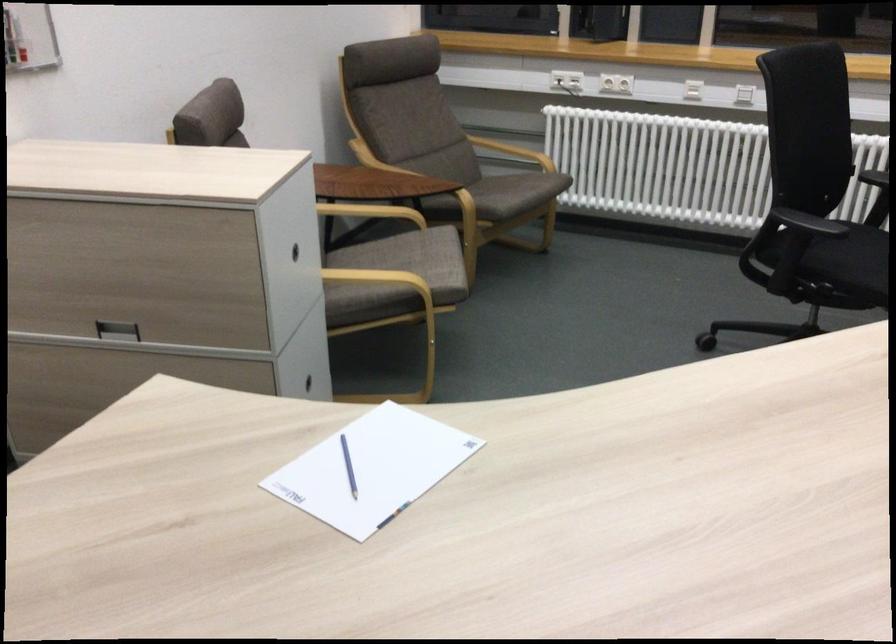
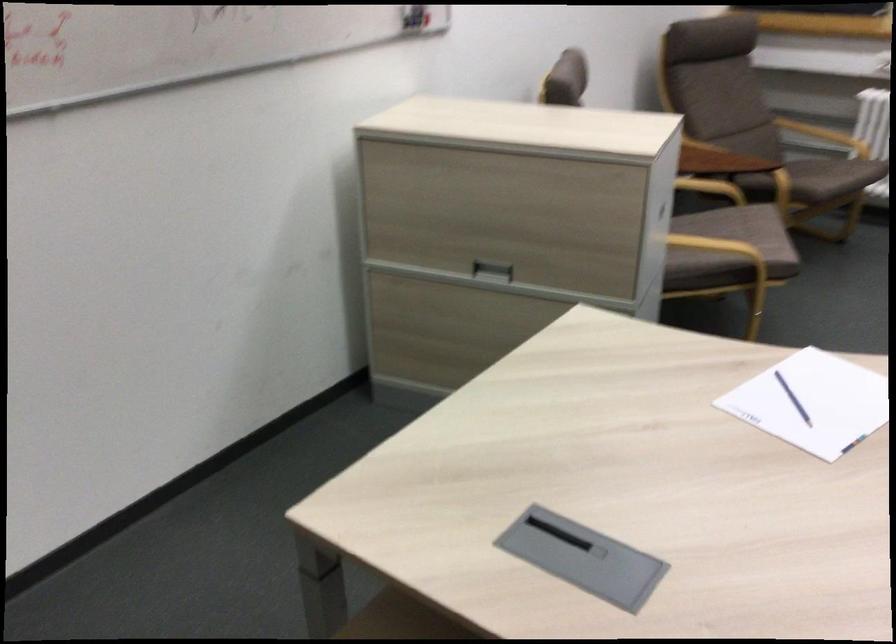
Where in the second image is the point corresponding to point 386,283 from the first image?

(721, 249)